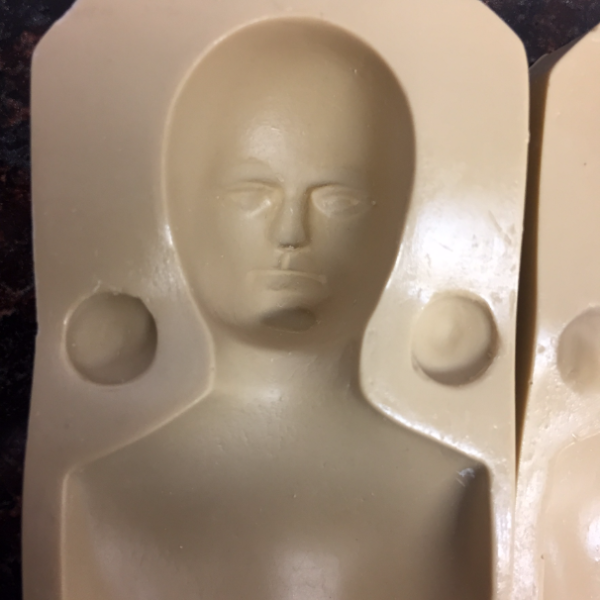
This screenshot has width=600, height=600. I want to click on ceramic, so click(x=401, y=420).